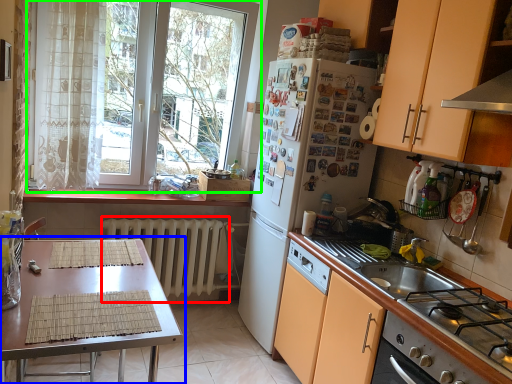
Question: Which object is positioned farthest from radiator (highlighted by a red box)? Select from table (highlighted by a blue box) and window (highlighted by a green box).

Choices:
 (A) table
 (B) window

Answer: (A)